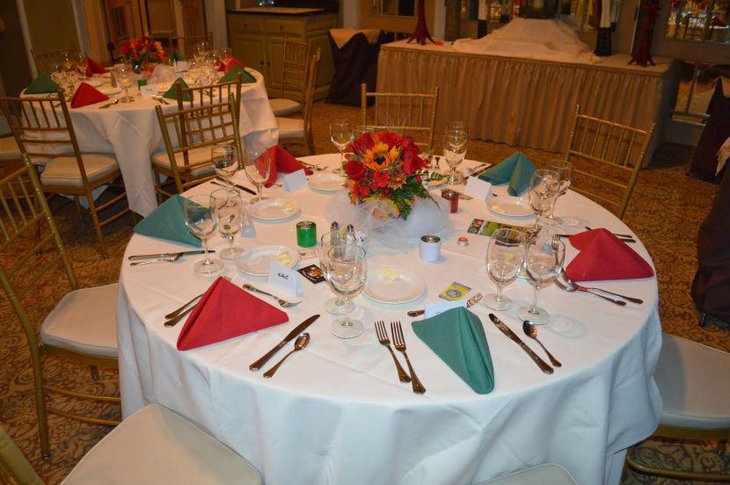
In order to click on glass in this screenshot , I will do [339, 270].